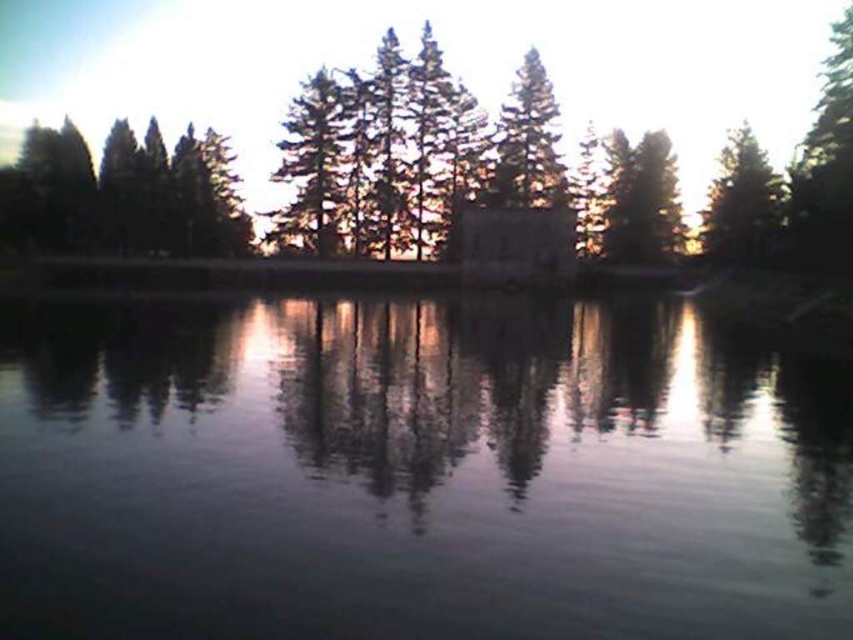
Does transparent liquid water at center appear under green matte tree at upper right?

Indeed, transparent liquid water at center is positioned under green matte tree at upper right.

This screenshot has width=853, height=640. Find the location of `transparent liquid water at center`. transparent liquid water at center is located at coordinates tap(416, 472).

Between transparent liquid water at center and green matte trees at left, which one is positioned higher?

green matte trees at left is above.

How distant is transparent liquid water at center from green matte trees at left?

transparent liquid water at center is 161.88 feet from green matte trees at left.

Between point (643, 419) and point (77, 228), which one is positioned in front?

Point (643, 419) is more forward.

This screenshot has width=853, height=640. Identify the location of transparent liquid water at center. (416, 472).

Which is more to the left, green matte trees at left or green matte tree at upper right?

From the viewer's perspective, green matte trees at left appears more on the left side.

Between green matte trees at left and green matte tree at upper right, which one appears on the right side from the viewer's perspective?

green matte tree at upper right is more to the right.

Does point (216, 152) come in front of point (751, 200)?

No, (216, 152) is behind (751, 200).

I want to click on green matte trees at left, so click(123, 195).